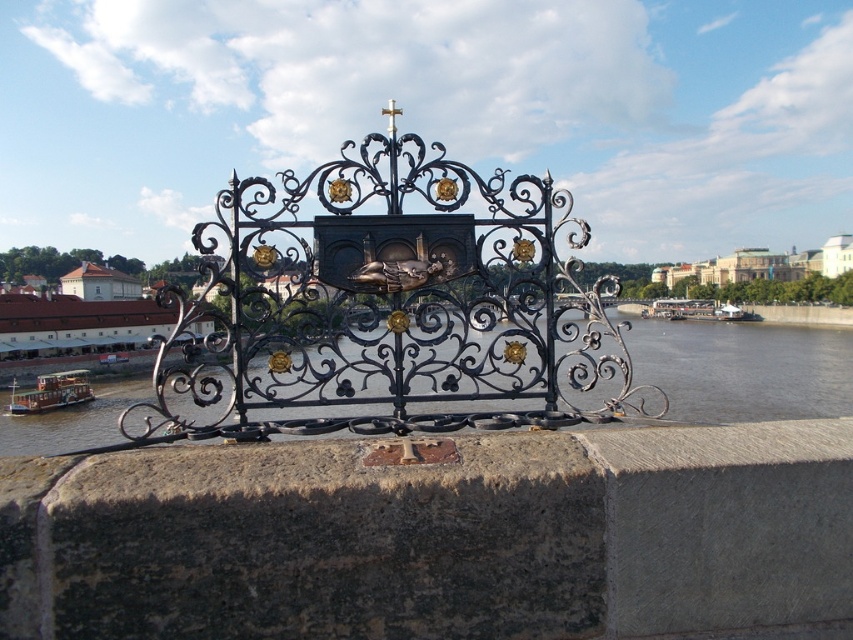
Which is in front, point (741, 346) or point (24, 406)?

Point (24, 406)

Does brown water at center have a lesser height compared to brown wooden boat at left?

In fact, brown water at center may be taller than brown wooden boat at left.

Who is more forward, (825, 388) or (47, 376)?

Point (47, 376) is in front.

Locate an element on the screen. The width and height of the screenshot is (853, 640). brown water at center is located at coordinates (743, 369).

Can you confirm if rusty stone ledge at center is taller than brown water at center?

Incorrect, rusty stone ledge at center's height is not larger of brown water at center's.

Can you confirm if rusty stone ledge at center is positioned to the left of brown water at center?

Indeed, rusty stone ledge at center is positioned on the left side of brown water at center.

What do you see at coordinates (434, 538) in the screenshot? This screenshot has height=640, width=853. I see `rusty stone ledge at center` at bounding box center [434, 538].

At what (x,y) coordinates should I click in order to perform the action: click on rusty stone ledge at center. Please return your answer as a coordinate pair (x, y). Looking at the image, I should click on (434, 538).

Is rusty stone ledge at center smaller than black wrought iron gate at center?

Indeed, rusty stone ledge at center has a smaller size compared to black wrought iron gate at center.

Does rusty stone ledge at center come in front of black wrought iron gate at center?

Yes, rusty stone ledge at center is closer to the viewer.

Find the location of a particular element. The image size is (853, 640). rusty stone ledge at center is located at coordinates (434, 538).

At what (x,y) coordinates should I click in order to perform the action: click on rusty stone ledge at center. Please return your answer as a coordinate pair (x, y). Image resolution: width=853 pixels, height=640 pixels. Looking at the image, I should click on (434, 538).